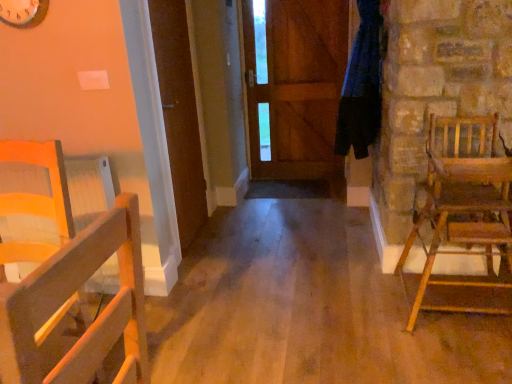
Question: From the image's perspective, does wooden rocking chair at right, acting as the 2th chair starting from the left, appear lower than wooden chair at left, the first chair positioned from the left?

Choices:
 (A) no
 (B) yes

Answer: (A)

Question: From a real-world perspective, is wooden rocking chair at right, acting as the 2th chair starting from the left, positioned under wooden chair at left, which is the second chair in right-to-left order, based on gravity?

Choices:
 (A) no
 (B) yes

Answer: (A)

Question: Can wooden chair at left, which is the second chair in right-to-left order, be found inside wooden rocking chair at right, acting as the 2th chair starting from the left?

Choices:
 (A) no
 (B) yes

Answer: (A)

Question: Is wooden rocking chair at right, marked as the 1th chair in a right-to-left arrangement, next to wooden chair at left, the first chair positioned from the left, and touching it?

Choices:
 (A) yes
 (B) no

Answer: (B)

Question: Considering the relative sizes of wooden rocking chair at right, acting as the 2th chair starting from the left, and wooden chair at left, the first chair positioned from the left, in the image provided, is wooden rocking chair at right, acting as the 2th chair starting from the left, shorter than wooden chair at left, the first chair positioned from the left,?

Choices:
 (A) yes
 (B) no

Answer: (B)

Question: Are wooden rocking chair at right, acting as the 2th chair starting from the left, and wooden chair at left, the first chair positioned from the left, far apart?

Choices:
 (A) no
 (B) yes

Answer: (B)

Question: From a real-world perspective, is blue fabric at right physically above wooden door at center, which ranks as the second door in left-to-right order?

Choices:
 (A) yes
 (B) no

Answer: (A)

Question: Does blue fabric at right appear on the right side of wooden door at center, marked as the 1th door in a back-to-front arrangement?

Choices:
 (A) yes
 (B) no

Answer: (A)

Question: Does blue fabric at right have a greater width compared to wooden door at center, which appears as the 1th door when viewed from the right?

Choices:
 (A) yes
 (B) no

Answer: (A)

Question: Considering the relative sizes of blue fabric at right and wooden door at center, which ranks as the second door in left-to-right order, in the image provided, is blue fabric at right taller than wooden door at center, which ranks as the second door in left-to-right order,?

Choices:
 (A) yes
 (B) no

Answer: (B)

Question: From the image's perspective, is blue fabric at right beneath wooden door at center, arranged as the second door when viewed from the front?

Choices:
 (A) yes
 (B) no

Answer: (A)

Question: Is wooden door at center, marked as the 1th door in a back-to-front arrangement, at the back of blue fabric at right?

Choices:
 (A) yes
 (B) no

Answer: (B)

Question: Are wooden door at center, arranged as the second door when viewed from the front, and wooden rocking chair at right, acting as the 2th chair starting from the left, far apart?

Choices:
 (A) yes
 (B) no

Answer: (A)